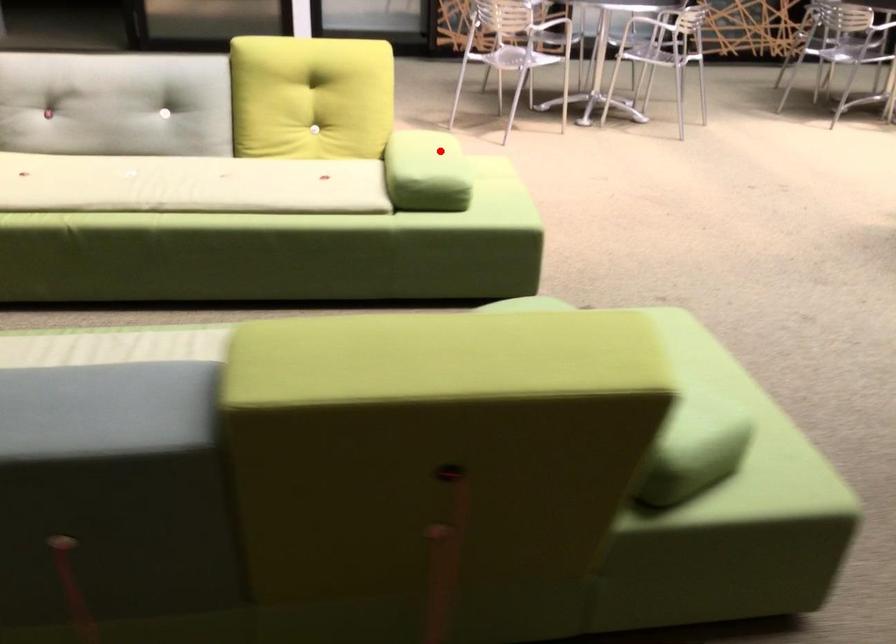
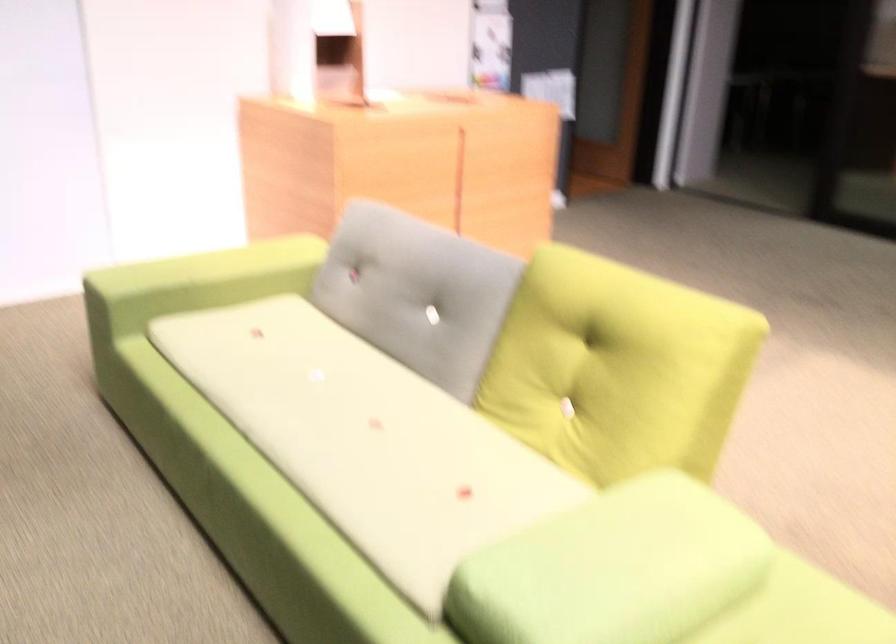
Where in the second image is the point corresponding to the highlighted location from the first image?

(613, 569)